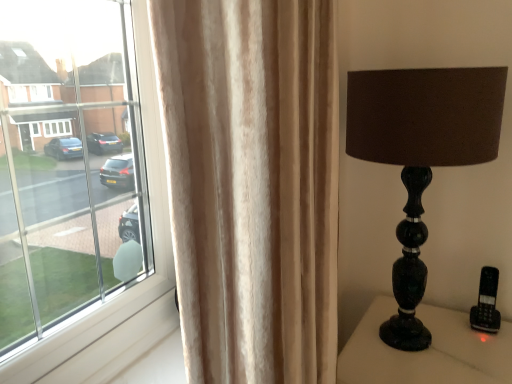
Question: Considering their positions, is shiny black glass lamp at right located in front of or behind beige velvet curtain at left?

Choices:
 (A) behind
 (B) front

Answer: (A)

Question: Is point tap(418, 340) positioned closer to the camera than point tap(196, 114)?

Choices:
 (A) farther
 (B) closer

Answer: (A)

Question: Based on their relative distances, which object is farther from the beige velvet curtain at left?

Choices:
 (A) shiny black glass lamp at right
 (B) black marble lamp at right

Answer: (B)

Question: Which object is positioned closest to the black marble lamp at right?

Choices:
 (A) shiny black glass lamp at right
 (B) beige velvet curtain at left

Answer: (A)